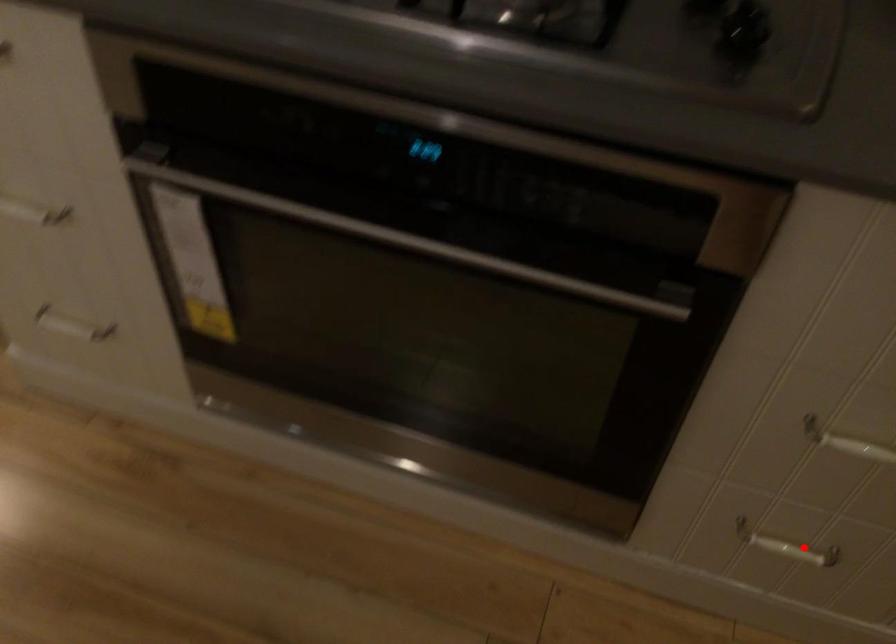
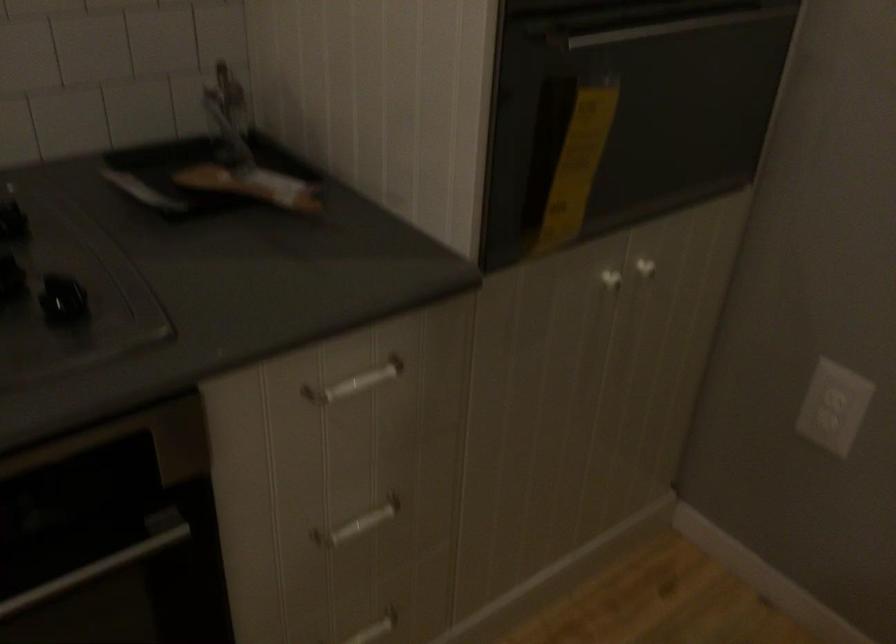
Locate, in the second image, the point that corresponds to the highlighted location in the first image.

(374, 629)